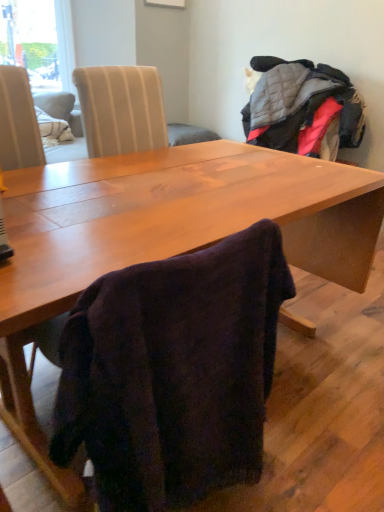
Describe the element at coordinates (166, 234) in the screenshot. The height and width of the screenshot is (512, 384). I see `wooden table at center` at that location.

At what (x,y) coordinates should I click in order to perform the action: click on wooden table at center. Please return your answer as a coordinate pair (x, y). Looking at the image, I should click on (166, 234).

At what (x,y) coordinates should I click in order to perform the action: click on wooden table at center. Please return your answer as a coordinate pair (x, y). The height and width of the screenshot is (512, 384). Looking at the image, I should click on (166, 234).